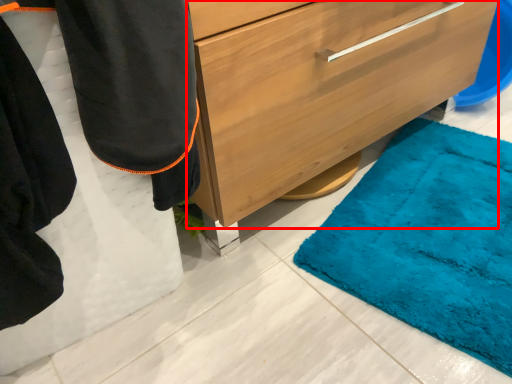
Question: From the image's perspective, where is chest of drawers (annotated by the red box) located in relation to robe in the image?

Choices:
 (A) above
 (B) below

Answer: (A)